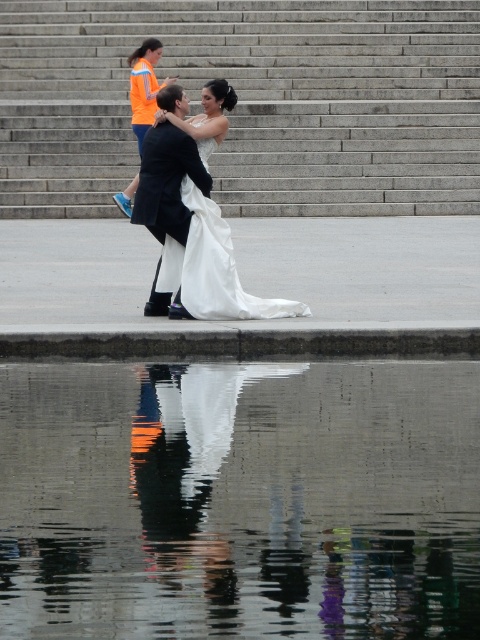
You are standing at the viewpoint of the image and want to know how far the point at coordinates (170, 83) is from you. Can you determine the distance?

The distance between point (170, 83) and the viewer is 22.39 meters.

You are a photographer trying to capture the couple dancing. You want to ensure the glossy reflective water at center and gray concrete stairs at center are both visible in your shot. Given their widths, which object should you focus on to include both in the frame?

Since the glossy reflective water at center is narrower than the gray concrete stairs at center, you should focus on the glossy reflective water at center as it takes up less space, allowing both objects to fit within the frame.

Looking at this image, you are a photographer trying to capture a group photo of the black formal suit at upper center and the orange fabric safety vest at upper left. Which of the two subjects should you focus on more to ensure they both fit in the frame?

The black formal suit at upper center has a larger width than the orange fabric safety vest at upper left, so you should focus more on the black formal suit at upper center to ensure both subjects fit in the frame.